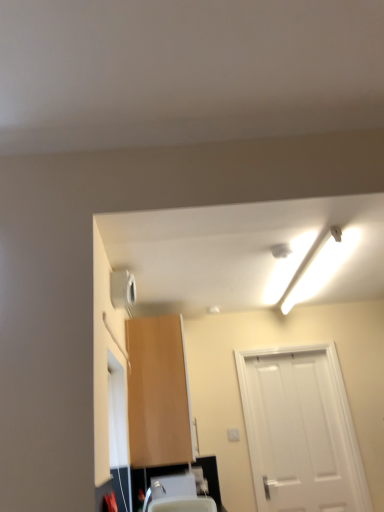
Question: Looking at their shapes, would you say light brown wood cabinet at center is wider or thinner than white fluorescent tube at upper right?

Choices:
 (A) thin
 (B) wide

Answer: (A)

Question: Considering the positions of light brown wood cabinet at center and white fluorescent tube at upper right in the image, is light brown wood cabinet at center bigger or smaller than white fluorescent tube at upper right?

Choices:
 (A) big
 (B) small

Answer: (A)

Question: Which of these objects is positioned farthest from the white matte door at right?

Choices:
 (A) satin nickel faucet at lower center
 (B) white fluorescent tube at upper right
 (C) light brown wood cabinet at center
 (D) white plastic sink at lower center

Answer: (A)

Question: Which of these objects is positioned farthest from the white matte door at right?

Choices:
 (A) light brown wood cabinet at center
 (B) satin nickel faucet at lower center
 (C) white plastic sink at lower center
 (D) white fluorescent tube at upper right

Answer: (B)